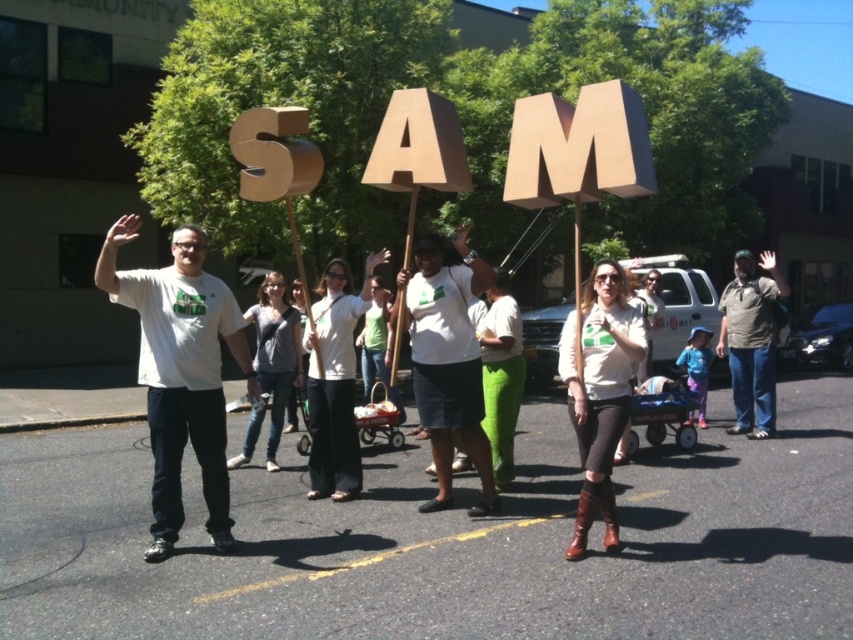
Who is more distant from viewer, (573, 376) or (728, 310)?

The point (728, 310) is more distant.

Between matte white sweater at center and gray cotton shirt at right, which one is positioned lower?

matte white sweater at center

Which is behind, point (618, 548) or point (764, 333)?

The point (764, 333) is more distant.

Image resolution: width=853 pixels, height=640 pixels. I want to click on matte white sweater at center, so click(x=601, y=392).

Does point (206, 497) come farther from viewer compared to point (630, 376)?

Yes, it is.

Describe the element at coordinates (180, 372) in the screenshot. I see `white matte t-shirt at left` at that location.

Identify the location of white matte t-shirt at left. (180, 372).

Between white matte t-shirt at left and gray cotton shirt at right, which one has more height?

Standing taller between the two is gray cotton shirt at right.

Is white matte t-shirt at left thinner than gray cotton shirt at right?

Correct, white matte t-shirt at left's width is less than gray cotton shirt at right's.

Is point (171, 458) closer to camera compared to point (737, 360)?

Yes.

The image size is (853, 640). In order to click on white matte t-shirt at left in this screenshot , I will do `click(180, 372)`.